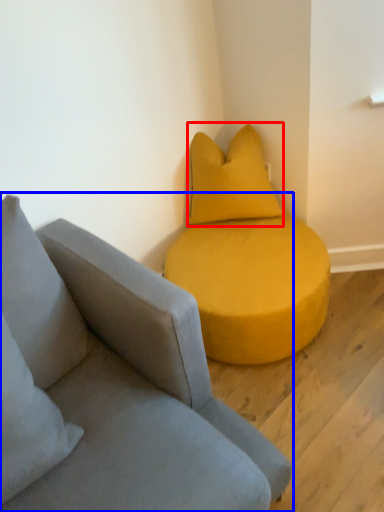
Question: Which of the following is the farthest to the observer, pillow (highlighted by a red box) or studio couch (highlighted by a blue box)?

Choices:
 (A) pillow
 (B) studio couch

Answer: (A)